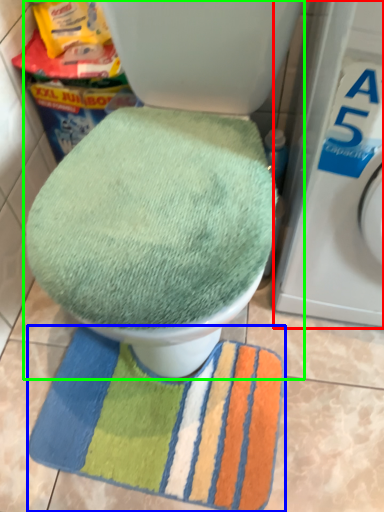
Question: Based on their relative distances, which object is nearer to washing machine (highlighted by a red box)? Choose from beach towel (highlighted by a blue box) and toilet (highlighted by a green box).

Choices:
 (A) beach towel
 (B) toilet

Answer: (B)